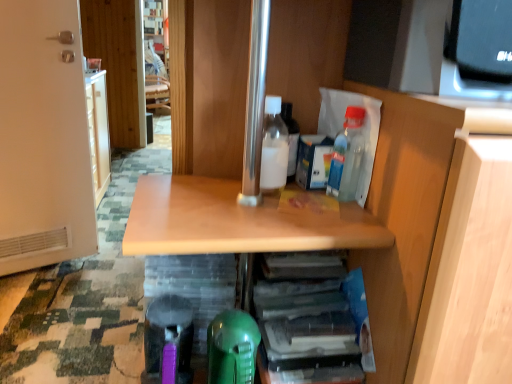
Question: From a real-world perspective, is white matte bottle at center, placed as the 1th bottle when sorted from left to right, located higher than white matte door at left?

Choices:
 (A) yes
 (B) no

Answer: (A)

Question: Does white matte bottle at center, which is the second bottle in right-to-left order, have a lesser width compared to white matte door at left?

Choices:
 (A) yes
 (B) no

Answer: (A)

Question: Is the position of white matte bottle at center, which is the second bottle in right-to-left order, less distant than that of white matte door at left?

Choices:
 (A) yes
 (B) no

Answer: (A)

Question: Is the position of white matte bottle at center, which is the second bottle in right-to-left order, more distant than that of white matte door at left?

Choices:
 (A) no
 (B) yes

Answer: (A)

Question: Is white matte bottle at center, placed as the 1th bottle when sorted from left to right, at the left side of white matte door at left?

Choices:
 (A) yes
 (B) no

Answer: (B)

Question: Is white matte bottle at center, which is the second bottle in right-to-left order, taller or shorter than white matte door at left?

Choices:
 (A) tall
 (B) short

Answer: (B)

Question: Considering the positions of point (268, 125) and point (0, 175), is point (268, 125) closer or farther from the camera than point (0, 175)?

Choices:
 (A) farther
 (B) closer

Answer: (B)

Question: Is white matte bottle at center, which is the second bottle in right-to-left order, inside the boundaries of white matte door at left, or outside?

Choices:
 (A) outside
 (B) inside

Answer: (A)

Question: From the image's perspective, relative to white matte door at left, is white matte bottle at center, which is the second bottle in right-to-left order, above or below?

Choices:
 (A) below
 (B) above

Answer: (A)

Question: Is translucent plastic stack of papers at lower center to the left or to the right of white matte door at left in the image?

Choices:
 (A) right
 (B) left

Answer: (A)

Question: Is translucent plastic stack of papers at lower center taller or shorter than white matte door at left?

Choices:
 (A) short
 (B) tall

Answer: (A)

Question: Relative to white matte door at left, is translucent plastic stack of papers at lower center in front or behind?

Choices:
 (A) behind
 (B) front

Answer: (B)

Question: Is translucent plastic stack of papers at lower center inside or outside of white matte door at left?

Choices:
 (A) inside
 (B) outside

Answer: (B)

Question: Is translucent plastic bottle at upper right, which appears as the 1th bottle when viewed from the right, bigger or smaller than white matte door at left?

Choices:
 (A) big
 (B) small

Answer: (B)

Question: From the image's perspective, is translucent plastic bottle at upper right, placed as the second bottle when sorted from left to right, located above or below white matte door at left?

Choices:
 (A) above
 (B) below

Answer: (B)